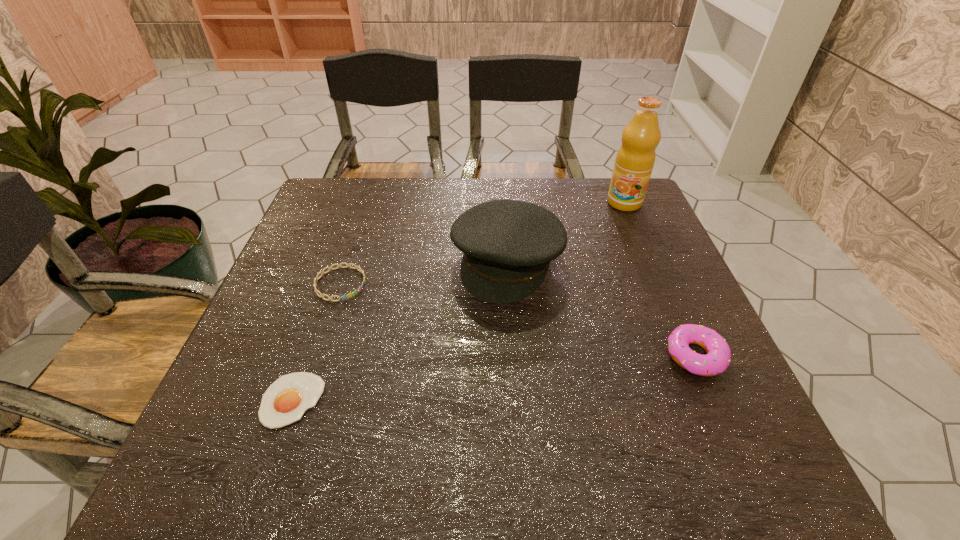
At what (x,y) coordinates should I click in order to perform the action: click on the shortest object. Please return your answer as a coordinate pair (x, y). This screenshot has height=540, width=960. Looking at the image, I should click on (285, 401).

The image size is (960, 540). I want to click on the third tallest object, so click(718, 357).

At what (x,y) coordinates should I click in order to perform the action: click on the fourth tallest object. Please return your answer as a coordinate pair (x, y). Looking at the image, I should click on (317, 278).

The image size is (960, 540). What are the coordinates of `the second tallest object` in the screenshot? It's located at (508, 245).

At what (x,y) coordinates should I click in order to perform the action: click on the third object from right to left. Please return your answer as a coordinate pair (x, y). Looking at the image, I should click on [508, 245].

Image resolution: width=960 pixels, height=540 pixels. Find the location of `fruit juice`. fruit juice is located at coordinates (635, 159).

At what (x,y) coordinates should I click in order to perform the action: click on the farthest object. Please return your answer as a coordinate pair (x, y). This screenshot has width=960, height=540. Looking at the image, I should click on (635, 159).

This screenshot has width=960, height=540. What are the coordinates of `vacant space located on the back of the shortest object` in the screenshot? It's located at (345, 248).

In order to click on vacant region located on the back of the doughnut in this screenshot , I will do `click(654, 261)`.

Where is `free space located on the surface of the bracelet showing star-shaped elements`? The width and height of the screenshot is (960, 540). free space located on the surface of the bracelet showing star-shaped elements is located at coordinates (395, 319).